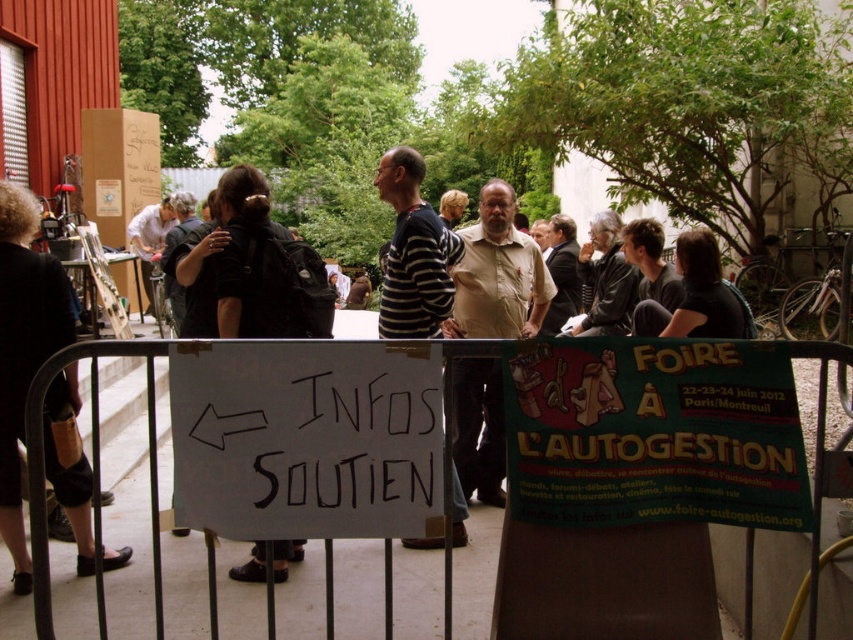
Is black backpack at center positioned in front of black leather jacket at center?

Yes.

Does point (183, 332) come behind point (722, 298)?

That is True.

Who is more forward, [227,314] or [709,332]?

Point [227,314]

This screenshot has height=640, width=853. Identify the location of black backpack at center. (230, 262).

Is point (490, 248) positioned after point (189, 240)?

Yes, point (490, 248) is behind point (189, 240).

Who is more distant from viewer, (502, 227) or (251, 236)?

Point (502, 227)

Is point (502, 458) positioned behind point (181, 266)?

Yes, point (502, 458) is farther from viewer.

Image resolution: width=853 pixels, height=640 pixels. Identify the location of beige cotton shirt at center. (498, 275).

Does green cardboard poster at center have a greater width compared to white paper sign at center?

Indeed, green cardboard poster at center has a greater width compared to white paper sign at center.

Which is behind, point (662, 493) or point (213, 353)?

The point (662, 493) is more distant.

The width and height of the screenshot is (853, 640). I want to click on green cardboard poster at center, so click(654, 433).